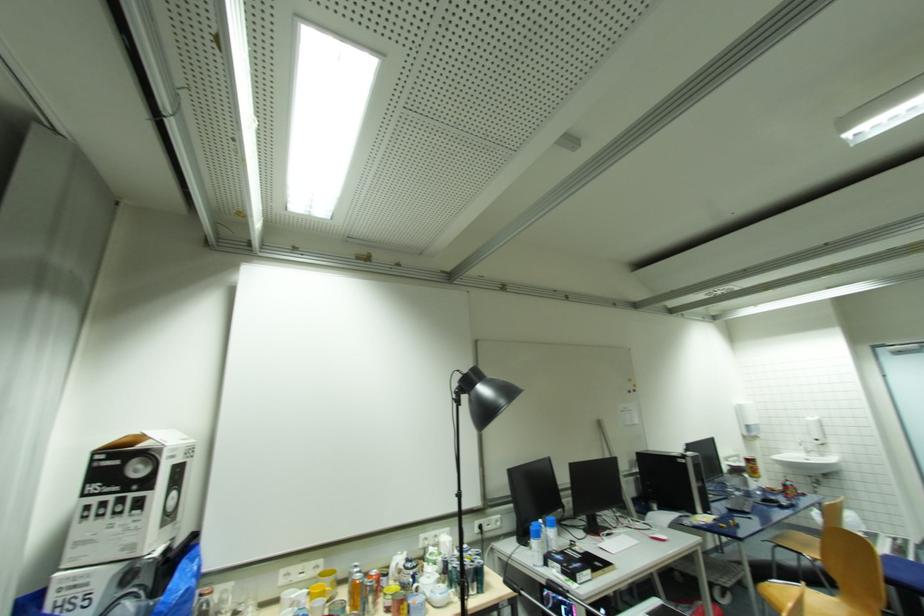
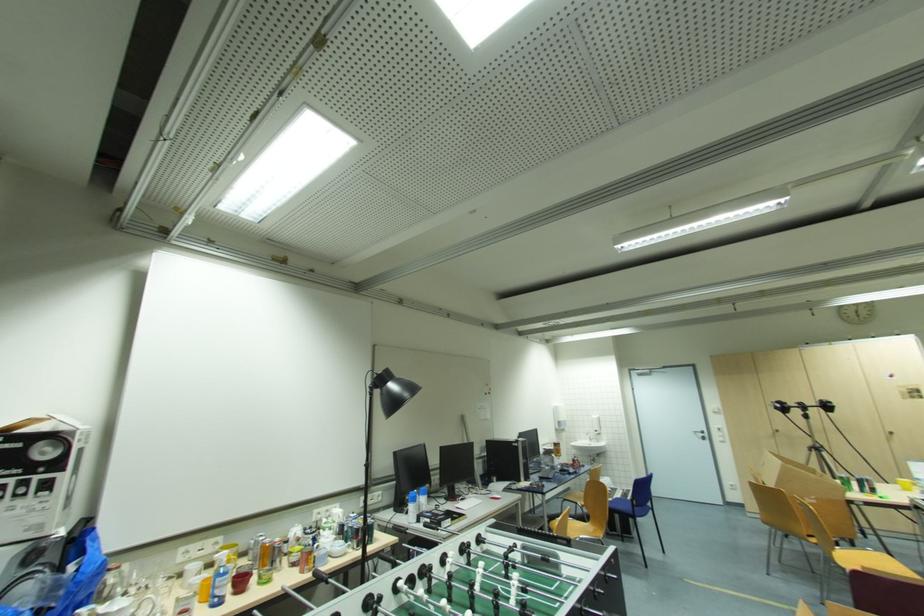
The point at (504, 402) is marked in the first image. Where is the corresponding point in the second image?

(409, 395)